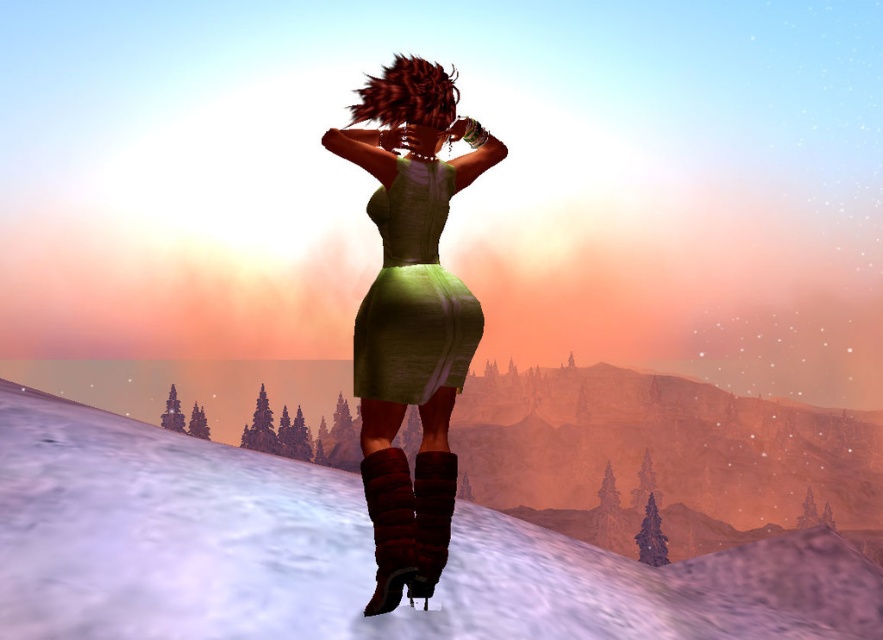
Which is more to the right, green fabric dress at center or green textured dress at center?

Positioned to the right is green textured dress at center.

Who is taller, green fabric dress at center or green textured dress at center?

With more height is green fabric dress at center.

Which is in front, point (442, 141) or point (440, 358)?

Point (440, 358)

Where is `green fabric dress at center`? green fabric dress at center is located at coordinates (411, 316).

Is the position of white fluffy snow at lower center less distant than that of knitted brown boot at lower center?

No.

Is point (300, 476) farther from viewer compared to point (390, 452)?

Yes, it is behind point (390, 452).

At what (x,y) coordinates should I click in order to perform the action: click on white fluffy snow at lower center. Please return your answer as a coordinate pair (x, y). Image resolution: width=883 pixels, height=640 pixels. Looking at the image, I should click on (345, 554).

Is green textured dress at center shorter than leather-like brown boot at lower center?

In fact, green textured dress at center may be taller than leather-like brown boot at lower center.

What do you see at coordinates (413, 296) in the screenshot?
I see `green textured dress at center` at bounding box center [413, 296].

Where is `green textured dress at center`? The width and height of the screenshot is (883, 640). green textured dress at center is located at coordinates (413, 296).